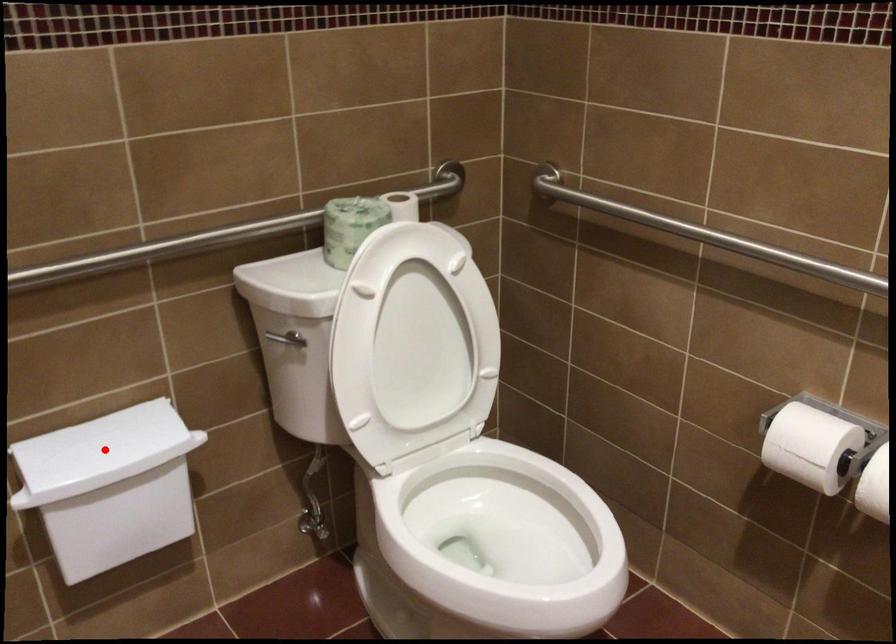
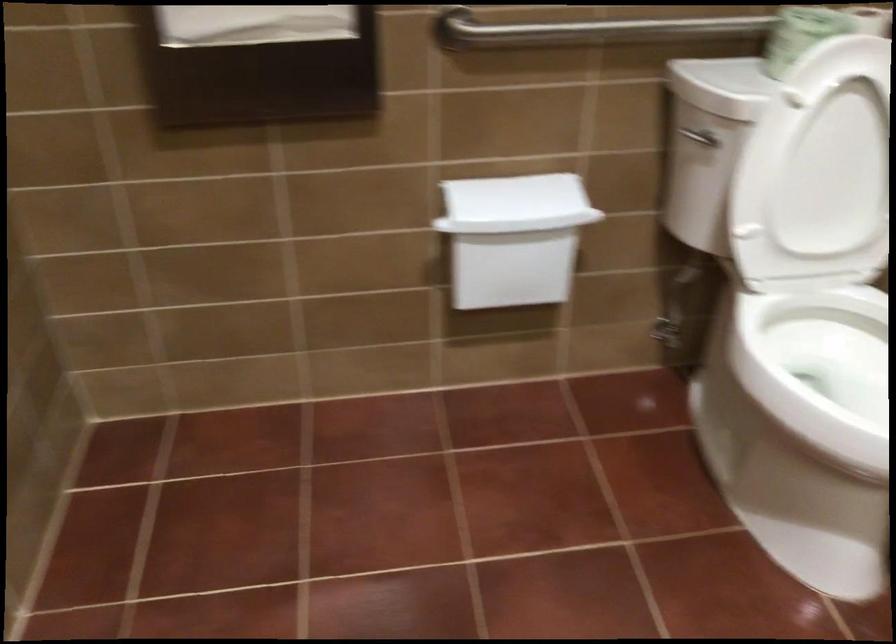
Question: I am providing you with two images of the same scene from different viewpoints. Image1 has a red point marked. In image2, the corresponding 3D location appears at what relative position? Reply with the corresponding letter.

Choices:
 (A) Closer
 (B) Farther

Answer: (B)